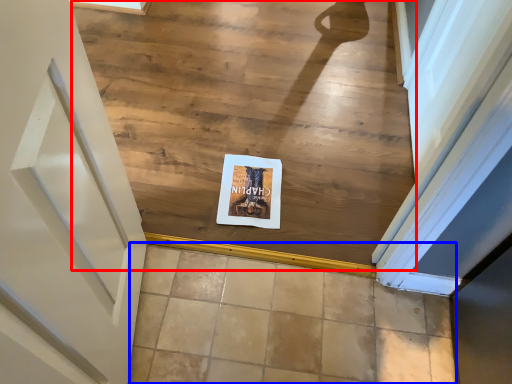
Question: Which of the following is the closest to the observer, stairwell (highlighted by a red box) or tile (highlighted by a blue box)?

Choices:
 (A) stairwell
 (B) tile

Answer: (B)